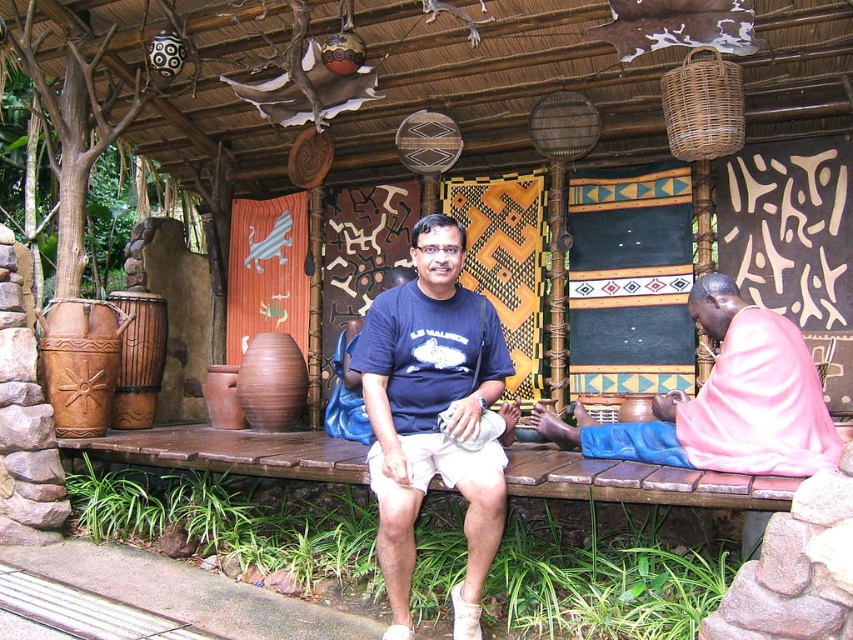
Question: Which is farther from the blue cotton t-shirt at center?

Choices:
 (A) brown matte vase at center
 (B) brown carved drum at left
 (C) pink fabric at right

Answer: (B)

Question: Is blue cotton t-shirt at center to the right of brown carved drum at left from the viewer's perspective?

Choices:
 (A) no
 (B) yes

Answer: (B)

Question: Does blue cotton t-shirt at center appear on the left side of brown carved drum at left?

Choices:
 (A) yes
 (B) no

Answer: (B)

Question: Which is nearer to the brown carved drum at left?

Choices:
 (A) blue cotton t-shirt at center
 (B) brown matte vase at center
 (C) pink fabric at right

Answer: (B)

Question: Is pink fabric at right in front of brown carved drum at left?

Choices:
 (A) yes
 (B) no

Answer: (A)

Question: Which object is positioned closest to the blue cotton t-shirt at center?

Choices:
 (A) brown carved drum at left
 (B) brown matte vase at center

Answer: (B)